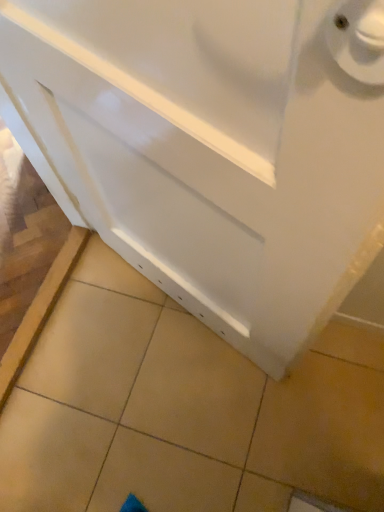
The width and height of the screenshot is (384, 512). Identify the location of free space in front of white glossy door at center. (198, 420).